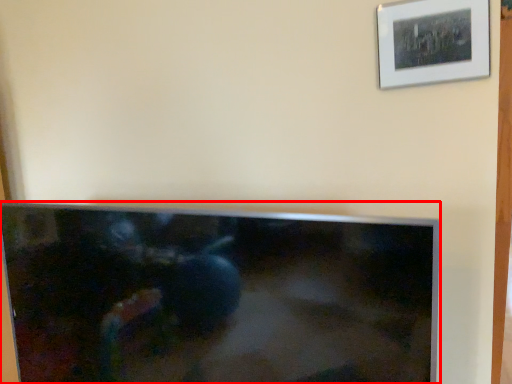
Question: From the image's perspective, where is television (annotated by the red box) located in relation to picture frame in the image?

Choices:
 (A) below
 (B) above

Answer: (A)